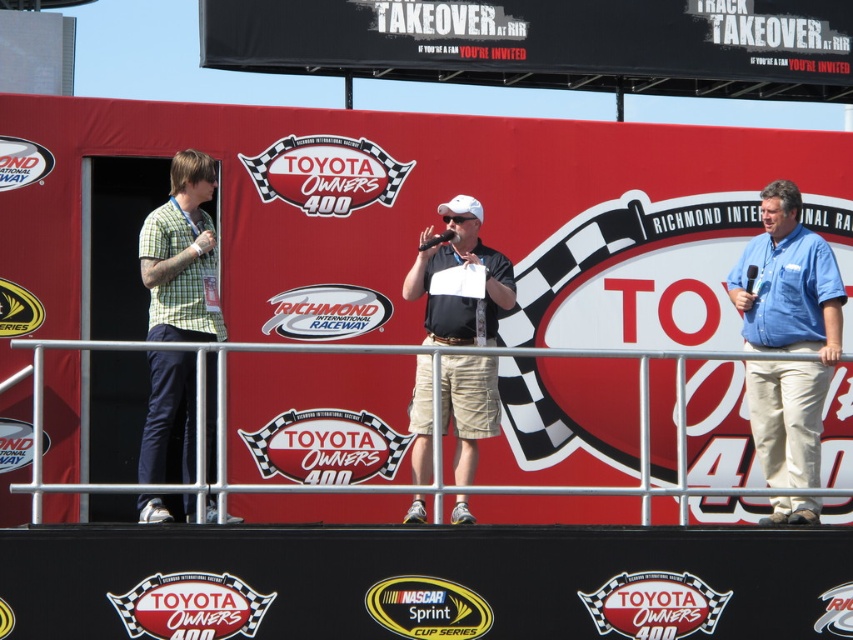
You are a photographer at the Toyota Owners 400 race and want to capture a photo of the matte black shirt at center and the metal at center. Based on their widths, which object should you focus on first if you want to ensure both are fully in frame without cropping?

The matte black shirt at center has a lesser width compared to metal at center, so you should focus on the wider metal at center first to ensure it fits within the frame, then adjust to include the narrower matte black shirt at center.